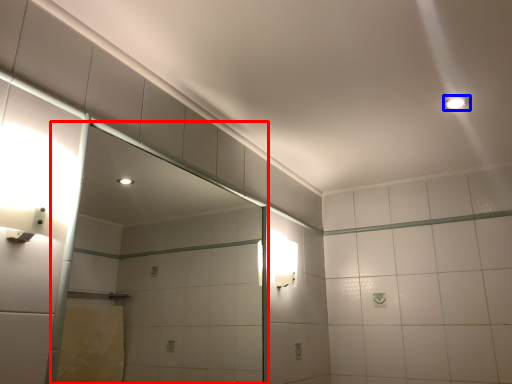
Question: Among these objects, which one is farthest to the camera, glass door (highlighted by a red box) or light fixture (highlighted by a blue box)?

Choices:
 (A) glass door
 (B) light fixture

Answer: (B)